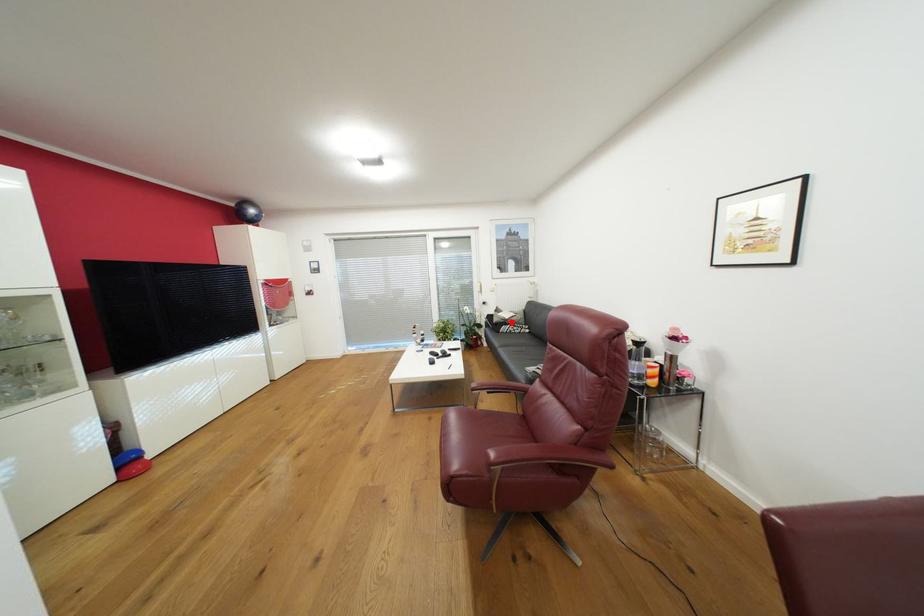
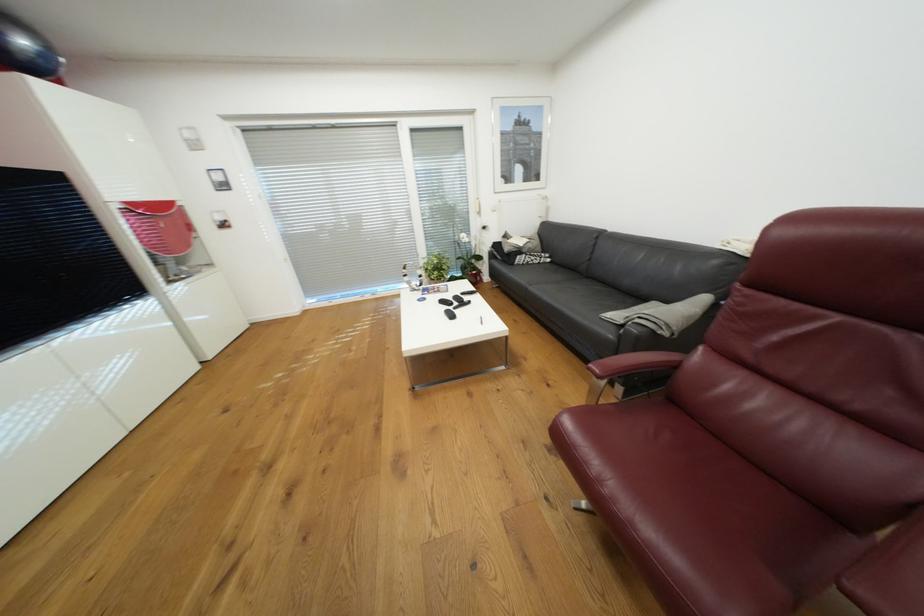
Locate, in the second image, the point that corresponds to the highlighted location in the first image.

(526, 252)